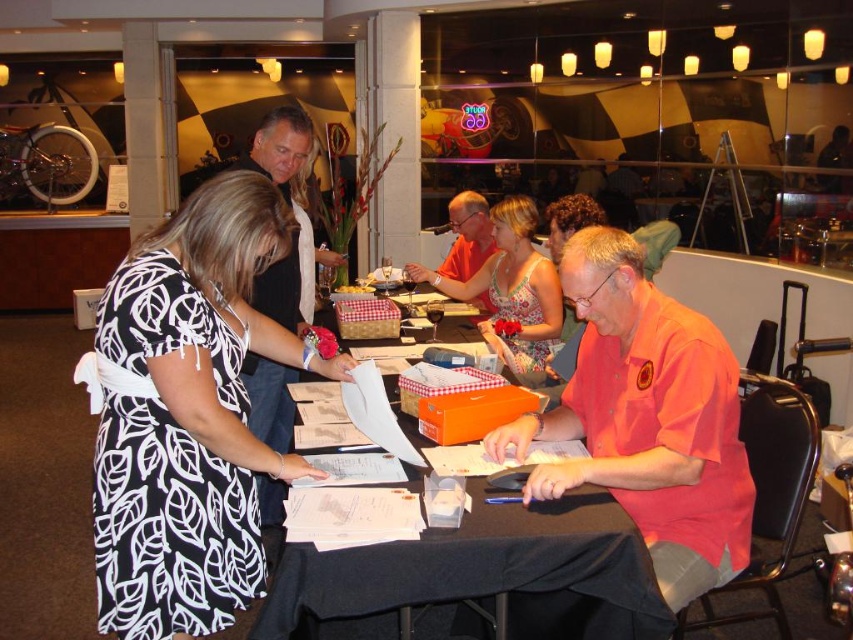
Question: Among these points, which one is farthest from the camera?

Choices:
 (A) coord(231,170)
 (B) coord(265,632)

Answer: (A)

Question: Is orange cotton shirt at center bigger than floral dress at center?

Choices:
 (A) yes
 (B) no

Answer: (B)

Question: Which point appears farthest from the camera in this image?

Choices:
 (A) (532, 560)
 (B) (604, 292)

Answer: (B)

Question: Does orange cotton shirt at center appear over floral dress at center?

Choices:
 (A) no
 (B) yes

Answer: (A)

Question: Which of these objects is positioned farthest from the orange cotton shirt at center?

Choices:
 (A) floral dress at center
 (B) black paper at center

Answer: (A)

Question: Where is black printed dress at center located in relation to floral dress at center in the image?

Choices:
 (A) below
 (B) above

Answer: (A)